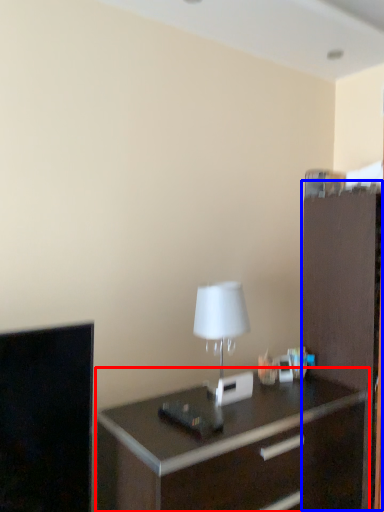
Question: Which point is closer to the camera, chest of drawers (highlighted by a red box) or file cabinet (highlighted by a blue box)?

Choices:
 (A) chest of drawers
 (B) file cabinet

Answer: (A)